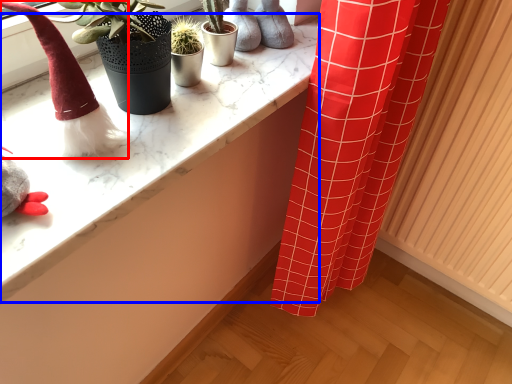
Question: Among these objects, which one is farthest to the camera, toy (highlighted by a red box) or counter top (highlighted by a blue box)?

Choices:
 (A) toy
 (B) counter top

Answer: (B)